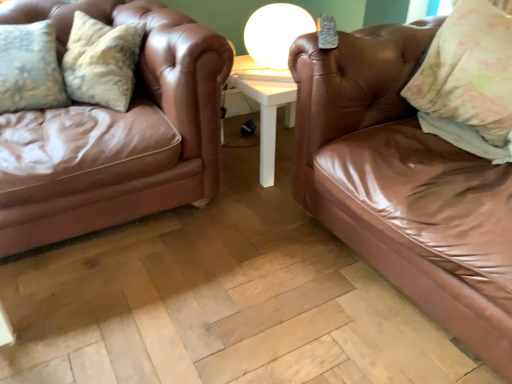
Question: From a real-world perspective, does shiny brown leather couch at right, which is the 2th studio couch in left-to-right order, stand above floral fabric pillow at upper right?

Choices:
 (A) yes
 (B) no

Answer: (B)

Question: From the image's perspective, is shiny brown leather couch at right, which is the 2th studio couch in left-to-right order, over floral fabric pillow at upper right?

Choices:
 (A) yes
 (B) no

Answer: (B)

Question: Is shiny brown leather couch at right, which is the 2th studio couch in left-to-right order, in front of floral fabric pillow at upper right?

Choices:
 (A) yes
 (B) no

Answer: (A)

Question: Can you confirm if shiny brown leather couch at right, which is the 2th studio couch in left-to-right order, is positioned to the left of floral fabric pillow at upper right?

Choices:
 (A) no
 (B) yes

Answer: (B)

Question: Considering the relative sizes of shiny brown leather couch at right, the 1th studio couch in the right-to-left sequence, and floral fabric pillow at upper right in the image provided, is shiny brown leather couch at right, the 1th studio couch in the right-to-left sequence, bigger than floral fabric pillow at upper right?

Choices:
 (A) yes
 (B) no

Answer: (A)

Question: Considering the relative sizes of shiny brown leather couch at right, which is the 2th studio couch in left-to-right order, and floral fabric pillow at upper right in the image provided, is shiny brown leather couch at right, which is the 2th studio couch in left-to-right order, wider than floral fabric pillow at upper right?

Choices:
 (A) yes
 (B) no

Answer: (A)

Question: From a real-world perspective, does brown leather couch at left, which is the first studio couch in left-to-right order, sit lower than white glossy table lamp at upper center?

Choices:
 (A) yes
 (B) no

Answer: (A)

Question: Is brown leather couch at left, which is the second studio couch in right-to-left order, next to white glossy table lamp at upper center and touching it?

Choices:
 (A) no
 (B) yes

Answer: (A)

Question: Considering the relative positions of brown leather couch at left, which is the first studio couch in left-to-right order, and white glossy table lamp at upper center in the image provided, is brown leather couch at left, which is the first studio couch in left-to-right order, behind white glossy table lamp at upper center?

Choices:
 (A) no
 (B) yes

Answer: (A)

Question: Is brown leather couch at left, which is the first studio couch in left-to-right order, facing away from white glossy table lamp at upper center?

Choices:
 (A) yes
 (B) no

Answer: (B)

Question: Does brown leather couch at left, which is the second studio couch in right-to-left order, appear on the left side of white glossy table lamp at upper center?

Choices:
 (A) no
 (B) yes

Answer: (B)

Question: Are brown leather couch at left, which is the second studio couch in right-to-left order, and white glossy table lamp at upper center located far from each other?

Choices:
 (A) no
 (B) yes

Answer: (A)

Question: Is the surface of floral fabric pillow at upper right in direct contact with shiny brown leather couch at right, which is the 2th studio couch in left-to-right order?

Choices:
 (A) no
 (B) yes

Answer: (A)